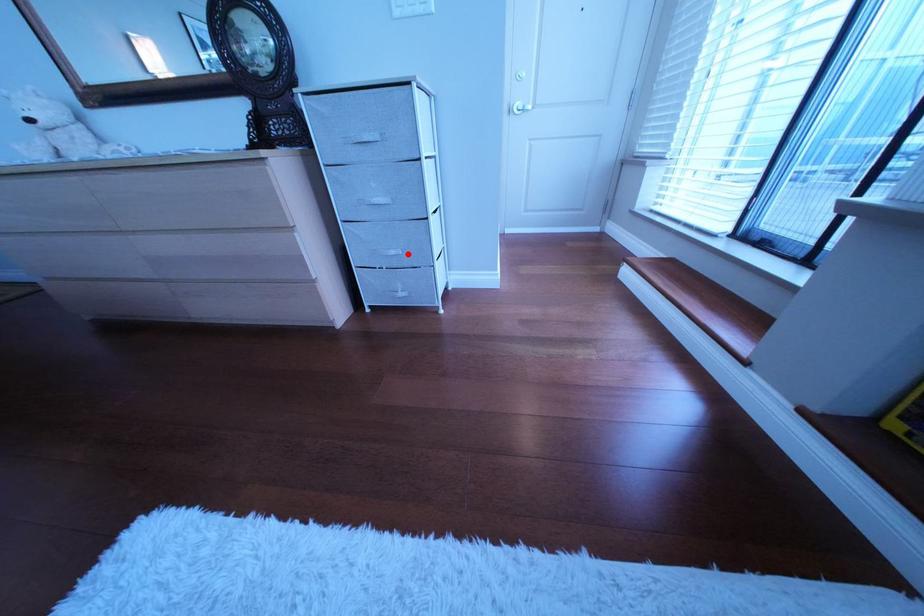
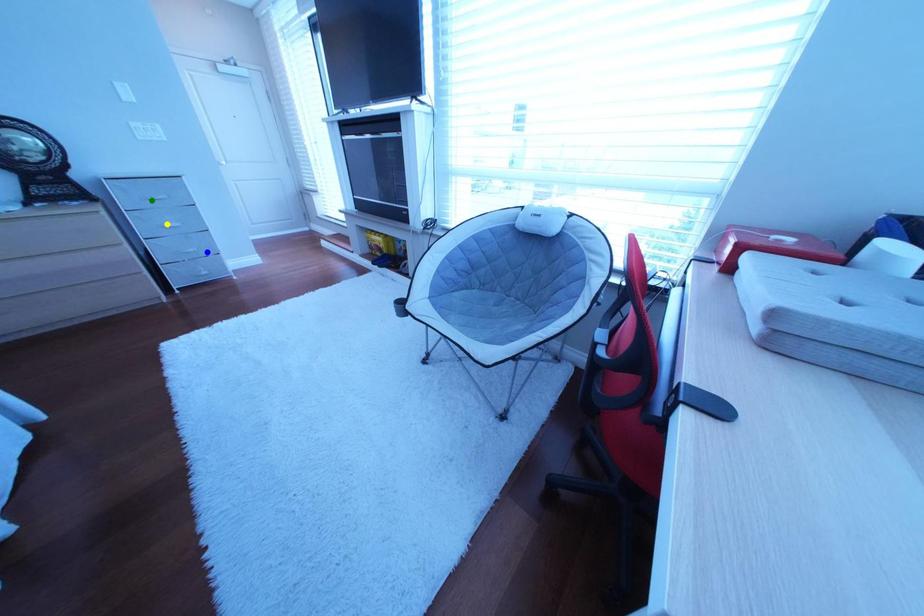
Question: I am providing you with two images of the same scene from different viewpoints. A red point is marked on the first image. You are given multiple points on the second image. Which point in image 2 is actually the same real-world point as the red point in image 1?

Choices:
 (A) blue point
 (B) yellow point
 (C) green point

Answer: (A)